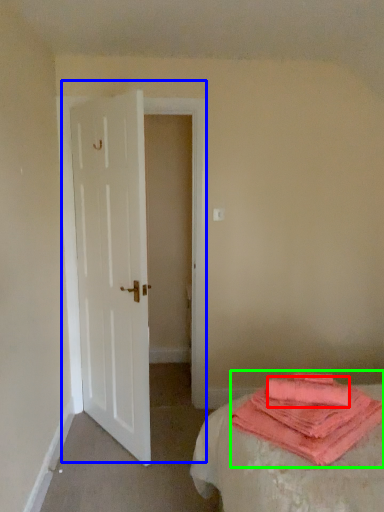
Question: Which is farther away from beach towel (highlighted by a red box)? door (highlighted by a blue box) or cloth (highlighted by a green box)?

Choices:
 (A) door
 (B) cloth

Answer: (A)